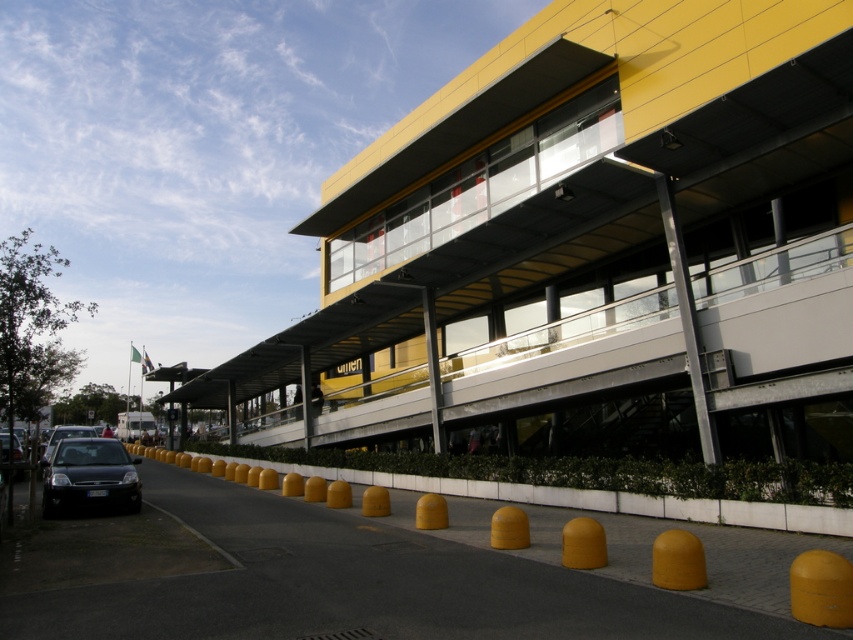
Question: Which point is farther to the camera?

Choices:
 (A) (186, 464)
 (B) (68, 428)
 (C) (845, 456)

Answer: (B)

Question: Does shiny black car at lower left appear on the right side of shiny black car at left?

Choices:
 (A) no
 (B) yes

Answer: (B)

Question: Which object is farther from the camera taking this photo?

Choices:
 (A) shiny black car at lower left
 (B) yellow rubber bollard at lower center

Answer: (A)

Question: Among these points, which one is farthest from the camera?

Choices:
 (A) (73, 472)
 (B) (62, 435)
 (C) (828, 492)
 (D) (430, 445)

Answer: (B)

Question: Does shiny black car at lower left lie behind shiny black car at left?

Choices:
 (A) no
 (B) yes

Answer: (A)

Question: Is yellow matte parking garage at center wider than shiny black car at left?

Choices:
 (A) no
 (B) yes

Answer: (A)